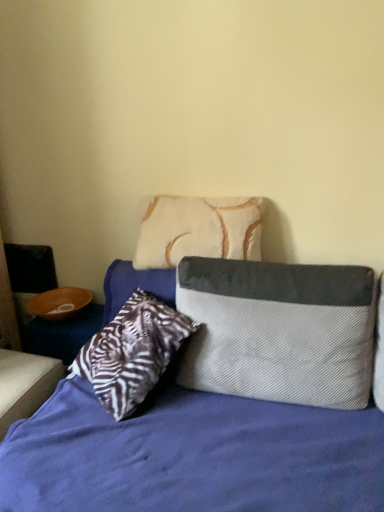
Image resolution: width=384 pixels, height=512 pixels. Describe the element at coordinates (191, 455) in the screenshot. I see `textured gray and white pillow at center` at that location.

What do you see at coordinates (279, 331) in the screenshot? The width and height of the screenshot is (384, 512). I see `textured gray pillow at center, arranged as the 1th pillow when ordered from the bottom` at bounding box center [279, 331].

You are a GUI agent. You are given a task and a screenshot of the screen. Output one action in this format:
    pyautogui.click(x=<x>, y=<y>)
    Task: Click on the textured gray and white pillow at center
    
    Given the screenshot: What is the action you would take?
    pyautogui.click(x=191, y=455)

Considering the relative sizes of textured gray pillow at center, arranged as the 1th pillow when ordered from the bottom, and textured gray and white pillow at center in the image provided, is textured gray pillow at center, arranged as the 1th pillow when ordered from the bottom, smaller than textured gray and white pillow at center?

Correct, textured gray pillow at center, arranged as the 1th pillow when ordered from the bottom, occupies less space than textured gray and white pillow at center.

From the picture: Would you say textured gray pillow at center, positioned as the 2th pillow in top-to-bottom order, is outside textured gray and white pillow at center?

Actually, textured gray pillow at center, positioned as the 2th pillow in top-to-bottom order, is within textured gray and white pillow at center.

Identify the location of the 1st pillow positioned above the textured gray and white pillow at center (from a real-world perspective). (279, 331).

In the image, is textured gray and white pillow at center on the left side or the right side of white fur pillow at upper center, which is counted as the 2th pillow, starting from the bottom?

textured gray and white pillow at center is positioned on white fur pillow at upper center, which is counted as the 2th pillow, starting from the bottom,'s right side.

Between textured gray and white pillow at center and white fur pillow at upper center, which is the 1th pillow in top-to-bottom order, which one has less height?

Standing shorter between the two is white fur pillow at upper center, which is the 1th pillow in top-to-bottom order.

Is point (183, 393) positioned after point (220, 212)?

No, (183, 393) is in front of (220, 212).

Which object is closer to the camera, textured gray pillow at center, arranged as the 1th pillow when ordered from the bottom, or white fur pillow at upper center, which is counted as the 2th pillow, starting from the bottom?

textured gray pillow at center, arranged as the 1th pillow when ordered from the bottom, is more forward.

Is textured gray pillow at center, positioned as the 2th pillow in top-to-bottom order, taller or shorter than white fur pillow at upper center, which is counted as the 2th pillow, starting from the bottom?

textured gray pillow at center, positioned as the 2th pillow in top-to-bottom order, is taller than white fur pillow at upper center, which is counted as the 2th pillow, starting from the bottom.

Considering the relative positions of textured gray pillow at center, positioned as the 2th pillow in top-to-bottom order, and white fur pillow at upper center, which is counted as the 2th pillow, starting from the bottom, in the image provided, is textured gray pillow at center, positioned as the 2th pillow in top-to-bottom order, to the right of white fur pillow at upper center, which is counted as the 2th pillow, starting from the bottom, from the viewer's perspective?

Correct, you'll find textured gray pillow at center, positioned as the 2th pillow in top-to-bottom order, to the right of white fur pillow at upper center, which is counted as the 2th pillow, starting from the bottom.

From the image's perspective, between textured gray pillow at center, positioned as the 2th pillow in top-to-bottom order, and white fur pillow at upper center, which is the 1th pillow in top-to-bottom order, which one is located above?

white fur pillow at upper center, which is the 1th pillow in top-to-bottom order, appears higher in the image.

Based on their sizes in the image, would you say textured gray and white pillow at center is bigger or smaller than textured gray pillow at center, positioned as the 2th pillow in top-to-bottom order?

Clearly, textured gray and white pillow at center is larger in size than textured gray pillow at center, positioned as the 2th pillow in top-to-bottom order.

Which object is thinner, textured gray and white pillow at center or textured gray pillow at center, positioned as the 2th pillow in top-to-bottom order?

textured gray pillow at center, positioned as the 2th pillow in top-to-bottom order, is thinner.

Starting from the textured gray and white pillow at center, which pillow is the 1st one behind? Please provide its 2D coordinates.

[(279, 331)]

Which is correct: white fur pillow at upper center, which is counted as the 2th pillow, starting from the bottom, is inside textured gray and white pillow at center, or outside of it?

white fur pillow at upper center, which is counted as the 2th pillow, starting from the bottom, is spatially positioned inside textured gray and white pillow at center.

Considering the sizes of objects white fur pillow at upper center, which is the 1th pillow in top-to-bottom order, and textured gray and white pillow at center in the image provided, who is shorter, white fur pillow at upper center, which is the 1th pillow in top-to-bottom order, or textured gray and white pillow at center?

Standing shorter between the two is white fur pillow at upper center, which is the 1th pillow in top-to-bottom order.

From a real-world perspective, which is physically above, white fur pillow at upper center, which is counted as the 2th pillow, starting from the bottom, or textured gray and white pillow at center?

white fur pillow at upper center, which is counted as the 2th pillow, starting from the bottom, from a real-world perspective.

Is white fur pillow at upper center, which is counted as the 2th pillow, starting from the bottom, positioned with its back to textured gray and white pillow at center?

No, white fur pillow at upper center, which is counted as the 2th pillow, starting from the bottom, is not facing away from textured gray and white pillow at center.

Considering the positions of objects white fur pillow at upper center, which is the 1th pillow in top-to-bottom order, and textured gray pillow at center, arranged as the 1th pillow when ordered from the bottom, in the image provided, who is more to the left, white fur pillow at upper center, which is the 1th pillow in top-to-bottom order, or textured gray pillow at center, arranged as the 1th pillow when ordered from the bottom,?

white fur pillow at upper center, which is the 1th pillow in top-to-bottom order.

Considering the positions of points (182, 243) and (349, 342), is point (182, 243) farther from camera compared to point (349, 342)?

Yes, point (182, 243) is behind point (349, 342).

Based on the photo, from a real-world perspective, is white fur pillow at upper center, which is counted as the 2th pillow, starting from the bottom, on top of textured gray pillow at center, positioned as the 2th pillow in top-to-bottom order?

Yes, from a real-world perspective, white fur pillow at upper center, which is counted as the 2th pillow, starting from the bottom, is above textured gray pillow at center, positioned as the 2th pillow in top-to-bottom order.

Relative to textured gray pillow at center, arranged as the 1th pillow when ordered from the bottom, is white fur pillow at upper center, which is counted as the 2th pillow, starting from the bottom, in front or behind?

In the image, white fur pillow at upper center, which is counted as the 2th pillow, starting from the bottom, appears behind textured gray pillow at center, arranged as the 1th pillow when ordered from the bottom.

Where is `pillow on the right of textured gray and white pillow at center`? The height and width of the screenshot is (512, 384). pillow on the right of textured gray and white pillow at center is located at coordinates (279, 331).

Image resolution: width=384 pixels, height=512 pixels. I want to click on the 2nd pillow above the textured gray and white pillow at center (from the image's perspective), so click(198, 230).

Looking at the image, which one is located further to textured gray pillow at center, arranged as the 1th pillow when ordered from the bottom, textured gray and white pillow at center or white fur pillow at upper center, which is the 1th pillow in top-to-bottom order?

Based on the image, white fur pillow at upper center, which is the 1th pillow in top-to-bottom order, appears to be further to textured gray pillow at center, arranged as the 1th pillow when ordered from the bottom.

Considering their positions, is white fur pillow at upper center, which is the 1th pillow in top-to-bottom order, positioned further to textured gray and white pillow at center than textured gray pillow at center, positioned as the 2th pillow in top-to-bottom order?

The object further to textured gray and white pillow at center is white fur pillow at upper center, which is the 1th pillow in top-to-bottom order.

Looking at the image, which one is located closer to textured gray pillow at center, arranged as the 1th pillow when ordered from the bottom, white fur pillow at upper center, which is the 1th pillow in top-to-bottom order, or textured gray and white pillow at center?

textured gray and white pillow at center lies closer to textured gray pillow at center, arranged as the 1th pillow when ordered from the bottom, than the other object.

Looking at the image, which one is located closer to white fur pillow at upper center, which is counted as the 2th pillow, starting from the bottom, textured gray and white pillow at center or textured gray pillow at center, arranged as the 1th pillow when ordered from the bottom?

The object closer to white fur pillow at upper center, which is counted as the 2th pillow, starting from the bottom, is textured gray pillow at center, arranged as the 1th pillow when ordered from the bottom.

In the scene shown: From the image, which object appears to be farther from white fur pillow at upper center, which is the 1th pillow in top-to-bottom order, textured gray pillow at center, arranged as the 1th pillow when ordered from the bottom, or textured gray and white pillow at center?

Based on the image, textured gray and white pillow at center appears to be further to white fur pillow at upper center, which is the 1th pillow in top-to-bottom order.

Estimate the real-world distances between objects in this image. Which object is further from textured gray and white pillow at center, textured gray pillow at center, positioned as the 2th pillow in top-to-bottom order, or white fur pillow at upper center, which is counted as the 2th pillow, starting from the bottom?

white fur pillow at upper center, which is counted as the 2th pillow, starting from the bottom.

Locate an element on the screen. This screenshot has height=512, width=384. pillow between textured gray and white pillow at center and white fur pillow at upper center, which is the 1th pillow in top-to-bottom order, in the front-back direction is located at coordinates (279, 331).